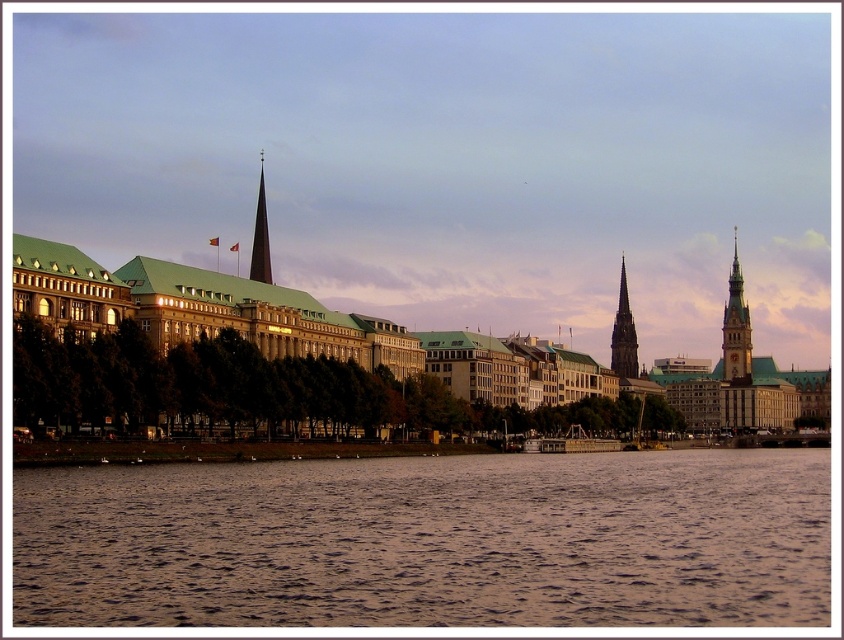
Question: Estimate the real-world distances between objects in this image. Which object is closer to the green matte building at center?

Choices:
 (A) dark gray stone spire at center right
 (B) brown water at lower center
 (C) gold textured clock tower at right
 (D) shiny dark glass spire at center

Answer: (A)

Question: Where is green matte building at center located in relation to shiny dark glass spire at center in the image?

Choices:
 (A) left
 (B) right

Answer: (B)

Question: Based on their relative distances, which object is nearer to the shiny dark glass spire at center?

Choices:
 (A) brown water at lower center
 (B) dark gray stone spire at center right
 (C) gold textured clock tower at right

Answer: (A)

Question: Is brown water at lower center wider than dark gray stone spire at center right?

Choices:
 (A) no
 (B) yes

Answer: (B)

Question: Is brown water at lower center below green matte building at center?

Choices:
 (A) yes
 (B) no

Answer: (A)

Question: Which point appears closest to the camera in this image?

Choices:
 (A) (734, 380)
 (B) (550, 392)

Answer: (B)